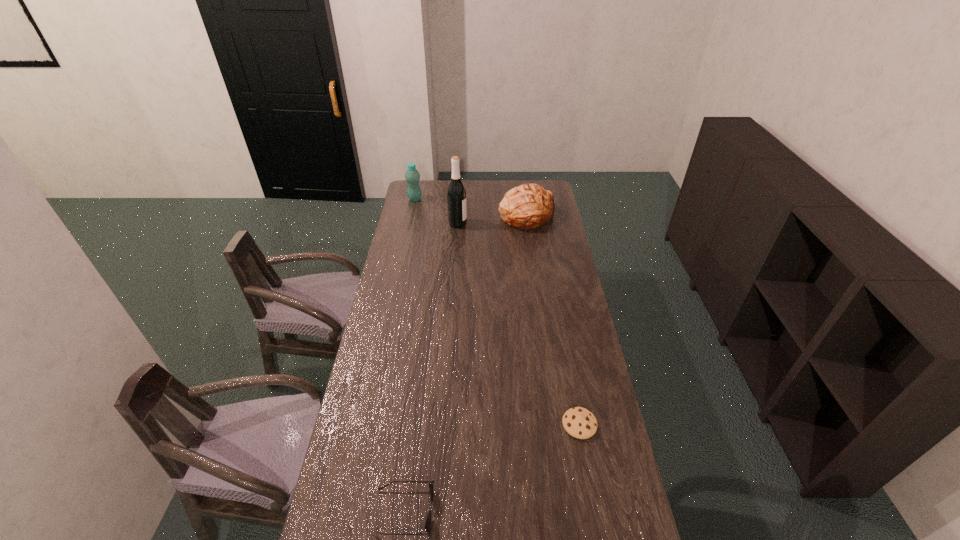
Locate an element on the screen. free space located on the left of the third shortest object is located at coordinates (434, 216).

Where is `vacant area located on the front-facing side of the fourth tallest object`? vacant area located on the front-facing side of the fourth tallest object is located at coordinates coord(469,511).

The image size is (960, 540). I want to click on free region located on the back of the cookie, so click(568, 366).

This screenshot has height=540, width=960. What are the coordinates of `water bottle that is at the far edge` in the screenshot? It's located at (412, 176).

What are the coordinates of `bread that is at the far edge` in the screenshot? It's located at (529, 206).

This screenshot has height=540, width=960. In order to click on water bottle that is at the left edge in this screenshot , I will do `click(412, 176)`.

Find the location of a particular element. sunglasses positioned at the left edge is located at coordinates (428, 521).

Where is `bread that is at the right edge`? bread that is at the right edge is located at coordinates (529, 206).

The height and width of the screenshot is (540, 960). Find the location of `cookie located in the right edge section of the desktop`. cookie located in the right edge section of the desktop is located at coordinates [x=580, y=423].

This screenshot has height=540, width=960. Identify the location of object located in the far left corner section of the desktop. (412, 176).